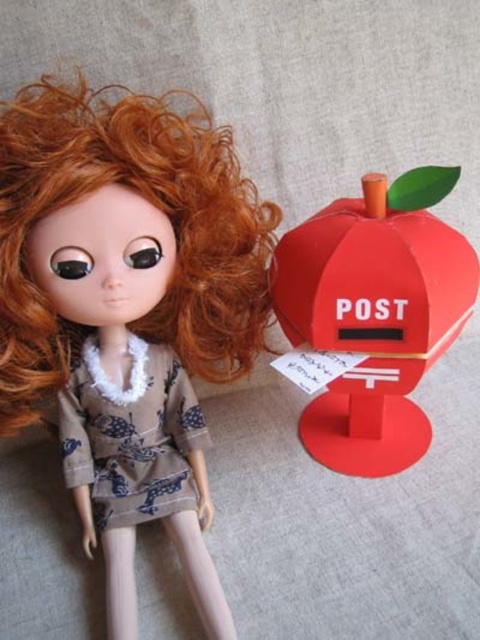
Question: Which of these objects is positioned closest to the matte brown fabric doll at upper left?

Choices:
 (A) matte red mailbox at right
 (B) printed fabric dress at center

Answer: (B)

Question: Does matte brown fabric doll at upper left appear on the left side of matte red mailbox at right?

Choices:
 (A) no
 (B) yes

Answer: (B)

Question: Is matte brown fabric doll at upper left closer to the viewer compared to printed fabric dress at center?

Choices:
 (A) yes
 (B) no

Answer: (A)

Question: Among these objects, which one is farthest from the camera?

Choices:
 (A) matte red mailbox at right
 (B) printed fabric dress at center
 (C) matte brown fabric doll at upper left

Answer: (B)

Question: Is matte red mailbox at right to the right of printed fabric dress at center from the viewer's perspective?

Choices:
 (A) no
 (B) yes

Answer: (B)

Question: Which point appears closest to the camera in this image?

Choices:
 (A) (155, 451)
 (B) (44, 84)

Answer: (B)